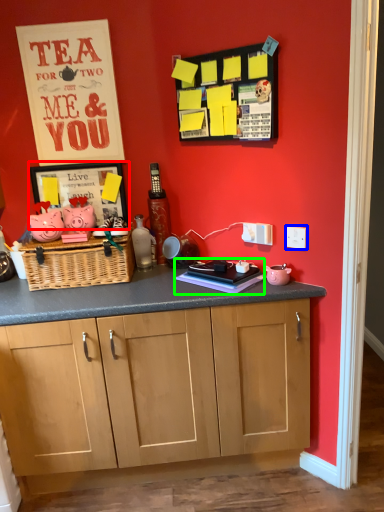
Question: Which object is the farthest from picture frame (highlighted by a red box)? Choose among these: electric outlet (highlighted by a blue box) or book (highlighted by a green box).

Choices:
 (A) electric outlet
 (B) book

Answer: (A)